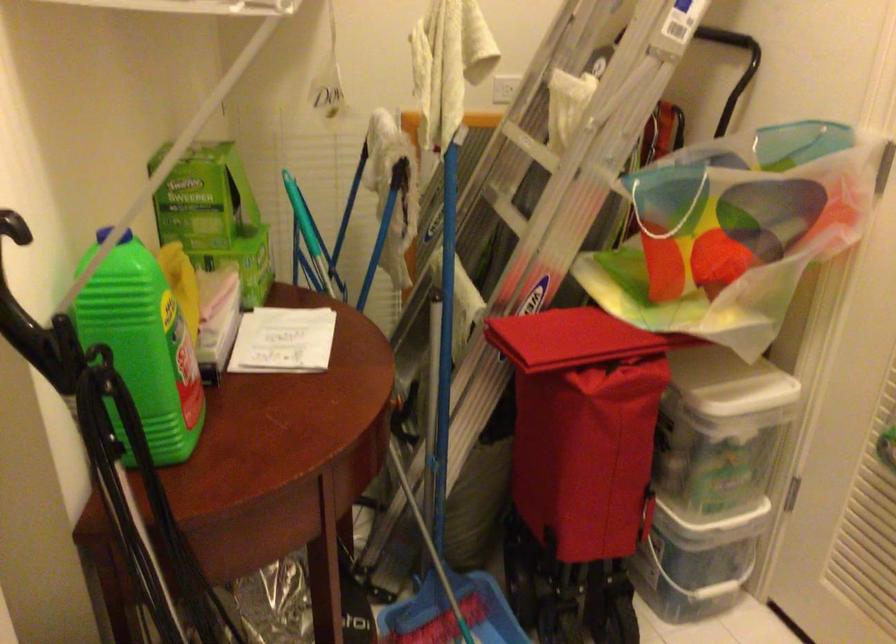
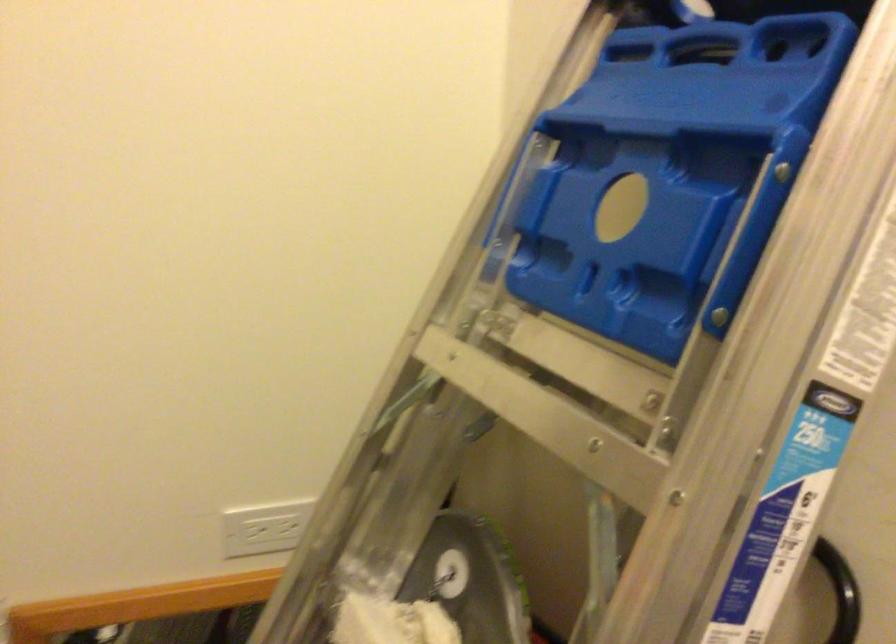
In the second image, find the point that corresponds to point 507,84 in the first image.

(263, 527)